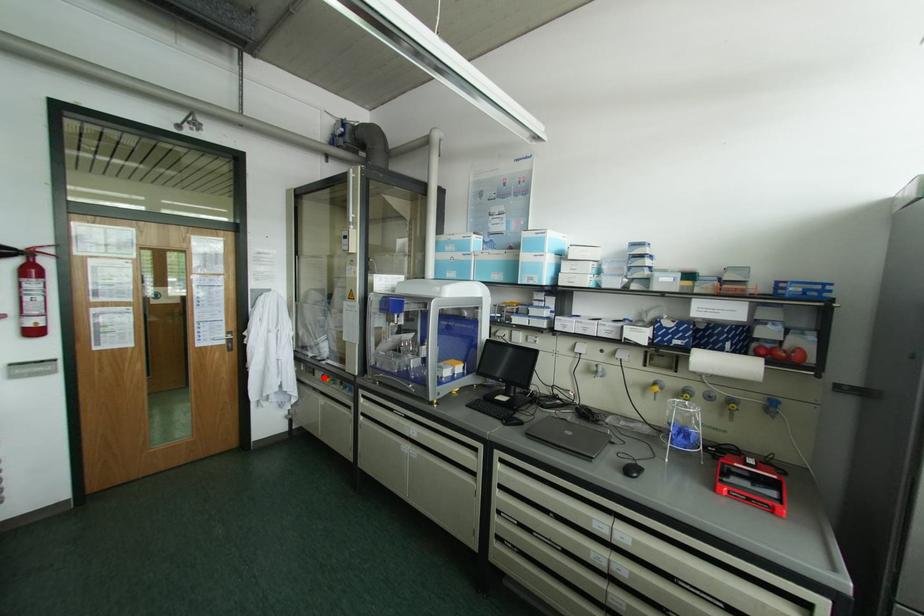
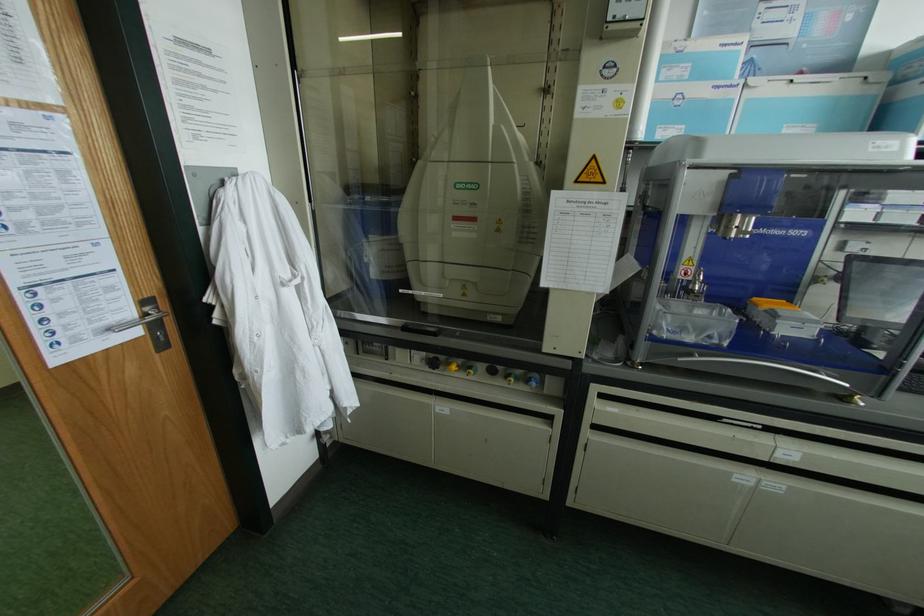
Question: I am providing you with two images of the same scene from different viewpoints. Image1 has a red point marked. In image2, the corresponding 3D location appears at what relative position? Reply with the corresponding letter.

Choices:
 (A) Closer
 (B) Farther

Answer: (A)